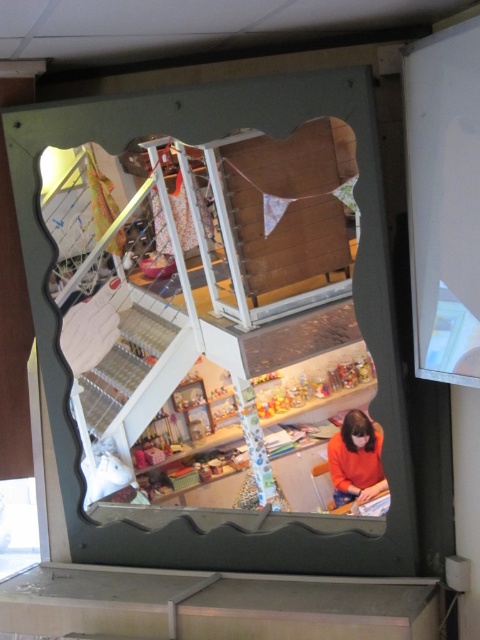
Which of these two, clear glass mirror at center or orange matte sweater at lower right, stands taller?

Standing taller between the two is clear glass mirror at center.

Does clear glass mirror at center lie in front of orange matte sweater at lower right?

Yes.

Is point (98, 163) positioned in front of point (363, 472)?

No.

You are a GUI agent. You are given a task and a screenshot of the screen. Output one action in this format:
    pyautogui.click(x=<x>, y=<y>)
    Task: Click on the clear glass mirror at center
    This screenshot has width=480, height=640.
    Given the screenshot: What is the action you would take?
    pyautogui.click(x=206, y=296)